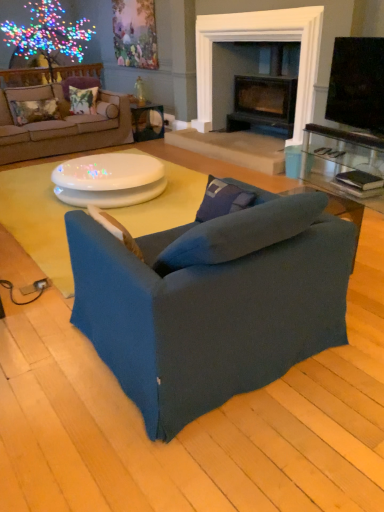
The width and height of the screenshot is (384, 512). I want to click on matte white table at center, the 2th table positioned from the bottom, so click(x=147, y=121).

What do you see at coordinates (109, 180) in the screenshot? The height and width of the screenshot is (512, 384). I see `white glossy coffee table at center, which is the 2th table in back-to-front order` at bounding box center [109, 180].

This screenshot has width=384, height=512. Describe the element at coordinates (260, 41) in the screenshot. I see `black glass fireplace at center` at that location.

Measure the distance between beige fabric couch at upper left, marked as the 1th studio couch in a back-to-front arrangement, and camera.

beige fabric couch at upper left, marked as the 1th studio couch in a back-to-front arrangement, and camera are 16.54 feet apart from each other.

The height and width of the screenshot is (512, 384). What do you see at coordinates (115, 229) in the screenshot? I see `suede-like blue pillow at center, the 4th pillow in the back-to-front sequence` at bounding box center [115, 229].

Where is `silky floral pillow at upper left, the 2th pillow from the back`? The height and width of the screenshot is (512, 384). silky floral pillow at upper left, the 2th pillow from the back is located at coordinates 83,100.

From the picture: Is silky floral pillow at upper left, the 2th pillow from the back, closer to the viewer compared to suede-like blue pillow at center, the 4th pillow in the back-to-front sequence?

No, silky floral pillow at upper left, the 2th pillow from the back, is behind suede-like blue pillow at center, the 4th pillow in the back-to-front sequence.

Which object is wider, silky floral pillow at upper left, the third pillow in the left-to-right sequence, or suede-like blue pillow at center, which appears as the 4th pillow when viewed from the top?

Wider between the two is silky floral pillow at upper left, the third pillow in the left-to-right sequence.

Which point is more forward, (81, 94) or (139, 256)?

The point (139, 256) is closer to the camera.

Is silky floral pillow at upper left, the 3th pillow from the bottom, to the right of suede-like blue pillow at center, the 4th pillow in the back-to-front sequence, from the viewer's perspective?

In fact, silky floral pillow at upper left, the 3th pillow from the bottom, is to the left of suede-like blue pillow at center, the 4th pillow in the back-to-front sequence.

Is black glass fireplace at center in front of or behind white glossy coffee table at center, which ranks as the 2th table in top-to-bottom order, in the image?

Visually, black glass fireplace at center is located behind white glossy coffee table at center, which ranks as the 2th table in top-to-bottom order.

This screenshot has width=384, height=512. Identify the location of table that is the 2nd object directly below the black glass fireplace at center (from a real-world perspective). (109, 180).

Which point is more distant from viewer, (318,52) or (120,184)?

The point (318,52) is farther from the camera.

Is black glass fireplace at center completely or partially outside of white glossy coffee table at center, the first table when ordered from front to back?

Yes, black glass fireplace at center is outside of white glossy coffee table at center, the first table when ordered from front to back.

In the scene shown: Does silky floral pillow at upper left, the third pillow in the left-to-right sequence, turn towards floral fabric pillow at upper left, arranged as the second pillow when viewed from the left?

No, silky floral pillow at upper left, the third pillow in the left-to-right sequence, is not aimed at floral fabric pillow at upper left, arranged as the second pillow when viewed from the left.

Is the depth of silky floral pillow at upper left, which appears as the third pillow when viewed from the front, less than that of floral fabric pillow at upper left, placed as the first pillow when sorted from back to front?

Yes, it is in front of floral fabric pillow at upper left, placed as the first pillow when sorted from back to front.

Is silky floral pillow at upper left, the 2th pillow from the back, spatially inside floral fabric pillow at upper left, the first pillow viewed from the top, or outside of it?

silky floral pillow at upper left, the 2th pillow from the back, is not enclosed by floral fabric pillow at upper left, the first pillow viewed from the top.

How distant is silky floral pillow at upper left, the third pillow in the left-to-right sequence, from floral fabric pillow at upper left, which is counted as the 4th pillow, starting from the front?

silky floral pillow at upper left, the third pillow in the left-to-right sequence, and floral fabric pillow at upper left, which is counted as the 4th pillow, starting from the front, are 6.78 inches apart.

Which object is positioned more to the right, floral fabric cushion at upper left, which is the third pillow in top-to-bottom order, or white glossy coffee table at center?

Positioned to the right is white glossy coffee table at center.

Is floral fabric cushion at upper left, which is the third pillow in top-to-bottom order, completely or partially outside of white glossy coffee table at center?

Indeed, floral fabric cushion at upper left, which is the third pillow in top-to-bottom order, is completely outside white glossy coffee table at center.

From a real-world perspective, relative to white glossy coffee table at center, is floral fabric cushion at upper left, which is the third pillow in top-to-bottom order, vertically above or below?

Clearly, from a real-world perspective, floral fabric cushion at upper left, which is the third pillow in top-to-bottom order, is above white glossy coffee table at center.

Can you confirm if floral fabric cushion at upper left, which is the third pillow in top-to-bottom order, is taller than white glossy coffee table at center?

Yes, floral fabric cushion at upper left, which is the third pillow in top-to-bottom order, is taller than white glossy coffee table at center.

Is white glossy coffee table at center, which ranks as the 2th table in top-to-bottom order, bigger than beige fabric couch at upper left, marked as the 1th studio couch in a back-to-front arrangement?

No.

Is white glossy coffee table at center, which ranks as the 2th table in top-to-bottom order, further to camera compared to beige fabric couch at upper left, which is the second studio couch in bottom-to-top order?

No, white glossy coffee table at center, which ranks as the 2th table in top-to-bottom order, is in front of beige fabric couch at upper left, which is the second studio couch in bottom-to-top order.

From the image's perspective, between white glossy coffee table at center, which ranks as the 2th table in top-to-bottom order, and beige fabric couch at upper left, arranged as the first studio couch when viewed from the top, who is located below?

white glossy coffee table at center, which ranks as the 2th table in top-to-bottom order.

Considering the sizes of objects white glossy coffee table at center, which is the 2th table in back-to-front order, and beige fabric couch at upper left, the second studio couch from the right, in the image provided, who is shorter, white glossy coffee table at center, which is the 2th table in back-to-front order, or beige fabric couch at upper left, the second studio couch from the right,?

Standing shorter between the two is white glossy coffee table at center, which is the 2th table in back-to-front order.

Could you tell me if black glossy tv at upper right is facing suede-like blue pillow at center, which is the first pillow in front-to-back order?

Yes, black glossy tv at upper right is turned towards suede-like blue pillow at center, which is the first pillow in front-to-back order.

From a real-world perspective, is black glossy tv at upper right below suede-like blue pillow at center, marked as the 1th pillow in a right-to-left arrangement?

No, from a real-world perspective, black glossy tv at upper right is not beneath suede-like blue pillow at center, marked as the 1th pillow in a right-to-left arrangement.

Does point (347, 78) come behind point (138, 248)?

Yes, point (347, 78) is behind point (138, 248).

Is black glossy tv at upper right to the left or to the right of suede-like blue pillow at center, which is the first pillow in front-to-back order, in the image?

Based on their positions, black glossy tv at upper right is located to the right of suede-like blue pillow at center, which is the first pillow in front-to-back order.

Is white glossy coffee table at center, which is the 2th table in back-to-front order, beside black glossy tv at upper right?

No, white glossy coffee table at center, which is the 2th table in back-to-front order, is not next to black glossy tv at upper right.

From the image's perspective, is white glossy coffee table at center, which ranks as the 2th table in top-to-bottom order, located above or below black glossy tv at upper right?

Based on their image positions, white glossy coffee table at center, which ranks as the 2th table in top-to-bottom order, is located beneath black glossy tv at upper right.

Between white glossy coffee table at center, the first table when ordered from front to back, and black glossy tv at upper right, which one has smaller size?

With smaller size is black glossy tv at upper right.

At what (x,y) coordinates should I click in order to perform the action: click on television in front of the white glossy coffee table at center, which ranks as the 2th table in top-to-bottom order. Please return your answer as a coordinate pair (x, y). This screenshot has width=384, height=512. Looking at the image, I should click on (357, 83).

Locate an element on the screen. pillow on the right of silky floral pillow at upper left, the 3th pillow from the bottom is located at coordinates (115, 229).

Locate an element on the screen. This screenshot has width=384, height=512. table that is the 2nd object to the left of the black glass fireplace at center, starting at the anchor is located at coordinates (109, 180).

From the image, which object appears to be nearer to beige fabric couch at upper left, arranged as the first studio couch when viewed from the top, black glass fireplace at center or dark blue fabric studio couch at center, which is the first studio couch from front to back?

black glass fireplace at center is closer to beige fabric couch at upper left, arranged as the first studio couch when viewed from the top.

Which object lies further to the anchor point floral fabric pillow at upper left, the first pillow viewed from the top, beige fabric couch at upper left, the first studio couch viewed from the left, or white glossy coffee table at center?

The object further to floral fabric pillow at upper left, the first pillow viewed from the top, is white glossy coffee table at center.

Based on their spatial positions, is black glass fireplace at center or white glossy coffee table at center further from floral fabric pillow at upper left, placed as the first pillow when sorted from back to front?

white glossy coffee table at center.

When comparing their distances from black glossy tv at upper right, does clear glass side table at right or suede-like blue pillow at center, marked as the fourth pillow in a left-to-right arrangement, seem further?

suede-like blue pillow at center, marked as the fourth pillow in a left-to-right arrangement, is positioned further to the anchor black glossy tv at upper right.

When comparing their distances from matte white table at center, arranged as the second table when viewed from the front, does clear glass side table at right or floral fabric cushion at upper left, arranged as the third pillow when viewed from the back, seem closer?

floral fabric cushion at upper left, arranged as the third pillow when viewed from the back.

Based on their spatial positions, is black glass fireplace at center or matte white table at center, which ranks as the 1th table in top-to-bottom order, further from white glossy coffee table at center?

Based on the image, black glass fireplace at center appears to be further to white glossy coffee table at center.

Which object lies nearer to the anchor point floral fabric cushion at upper left, marked as the second pillow in a front-to-back arrangement, white glossy coffee table at center or clear glass side table at right?

white glossy coffee table at center.

Considering their positions, is black glossy tv at upper right positioned closer to clear glass side table at right than floral fabric pillow at upper left, which is counted as the 4th pillow, starting from the front?

black glossy tv at upper right lies closer to clear glass side table at right than the other object.

The image size is (384, 512). Identify the location of table between dark blue fabric studio couch at center, arranged as the second studio couch when viewed from the back, and beige fabric couch at upper left, marked as the 1th studio couch in a back-to-front arrangement, along the z-axis. (109, 180).

Where is `television between floral fabric cushion at upper left, acting as the second pillow starting from the bottom, and clear glass side table at right, in the horizontal direction`? television between floral fabric cushion at upper left, acting as the second pillow starting from the bottom, and clear glass side table at right, in the horizontal direction is located at coordinates (357, 83).

Find the location of a particular element. fireplace between floral fabric cushion at upper left, which is the third pillow in top-to-bottom order, and black glossy tv at upper right is located at coordinates (260, 41).

Locate an element on the screen. Image resolution: width=384 pixels, height=512 pixels. side table positioned between dark blue fabric studio couch at center, arranged as the second studio couch when viewed from the back, and white glossy coffee table at center, which is the 2th table in back-to-front order, from near to far is located at coordinates (342, 160).